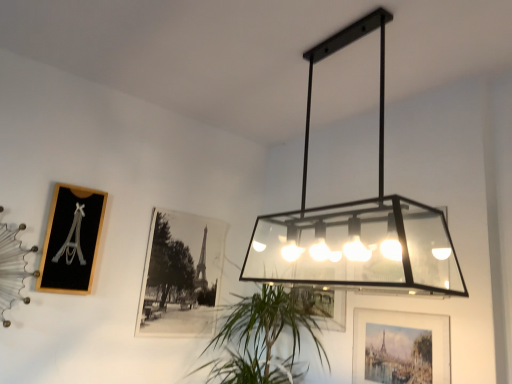
Question: Does matte black rectangular light fixture at upper center appear on the left side of black wood picture frame at left, which appears as the 1th picture frame when viewed from the left?

Choices:
 (A) no
 (B) yes

Answer: (A)

Question: Is matte black rectangular light fixture at upper center positioned with its back to black wood picture frame at left, which appears as the 1th picture frame when viewed from the left?

Choices:
 (A) yes
 (B) no

Answer: (B)

Question: Is matte black rectangular light fixture at upper center completely or partially outside of black wood picture frame at left, which appears as the 3th picture frame when viewed from the right?

Choices:
 (A) yes
 (B) no

Answer: (A)

Question: From a real-world perspective, is matte black rectangular light fixture at upper center beneath black wood picture frame at left, which appears as the 1th picture frame when viewed from the left?

Choices:
 (A) yes
 (B) no

Answer: (B)

Question: Considering the relative sizes of matte black rectangular light fixture at upper center and black wood picture frame at left, which appears as the 3th picture frame when viewed from the right, in the image provided, is matte black rectangular light fixture at upper center bigger than black wood picture frame at left, which appears as the 3th picture frame when viewed from the right,?

Choices:
 (A) yes
 (B) no

Answer: (A)

Question: Considering the positions of point (411, 225) and point (268, 304), is point (411, 225) closer or farther from the camera than point (268, 304)?

Choices:
 (A) farther
 (B) closer

Answer: (B)

Question: Is matte black rectangular light fixture at upper center inside the boundaries of green leafy plant at center, or outside?

Choices:
 (A) inside
 (B) outside

Answer: (B)

Question: From the image's perspective, is matte black rectangular light fixture at upper center positioned above or below green leafy plant at center?

Choices:
 (A) below
 (B) above

Answer: (B)

Question: In terms of width, does matte black rectangular light fixture at upper center look wider or thinner when compared to green leafy plant at center?

Choices:
 (A) wide
 (B) thin

Answer: (B)

Question: From a real-world perspective, relative to black matte photo frame at center, which is counted as the second picture frame, starting from the right, is matte black rectangular light fixture at upper center vertically above or below?

Choices:
 (A) above
 (B) below

Answer: (A)

Question: In terms of width, does matte black rectangular light fixture at upper center look wider or thinner when compared to black matte photo frame at center, the 2th picture frame when ordered from left to right?

Choices:
 (A) thin
 (B) wide

Answer: (B)

Question: Is matte black rectangular light fixture at upper center in front of or behind black matte photo frame at center, the 2th picture frame when ordered from left to right, in the image?

Choices:
 (A) behind
 (B) front

Answer: (B)

Question: Considering the relative positions of matte black rectangular light fixture at upper center and black matte photo frame at center, which is counted as the second picture frame, starting from the right, in the image provided, is matte black rectangular light fixture at upper center to the left or to the right of black matte photo frame at center, which is counted as the second picture frame, starting from the right,?

Choices:
 (A) right
 (B) left

Answer: (A)

Question: Is point (152, 297) closer or farther from the camera than point (55, 264)?

Choices:
 (A) closer
 (B) farther

Answer: (B)

Question: Looking at their shapes, would you say black matte photo frame at center, the 2th picture frame when ordered from left to right, is wider or thinner than black wood picture frame at left, which appears as the 3th picture frame when viewed from the right?

Choices:
 (A) wide
 (B) thin

Answer: (B)